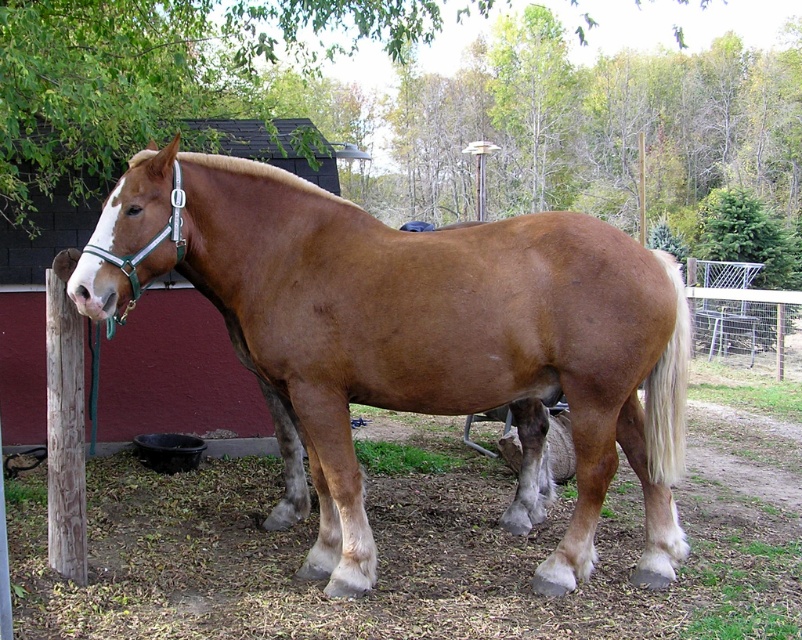
You are a farmer checking the space between the brown glossy horse at center and the white silky tail at right. You need to place a 4 feet wide feeding trough between them. Will it fit?

The distance between the brown glossy horse at center and the white silky tail at right is 3.88 feet, which is less than the 4 feet width of the feeding trough. Therefore, the trough will not fit between them.

You are a farmer checking the height of the animals in your barn. You have a 1.5 meter ladder that you need to place near the brown glossy horse at center and the white silky tail at right. Which animal requires the ladder to be placed higher?

The brown glossy horse at center requires the ladder to be placed higher because it has a greater height compared to the white silky tail at right.

You are a farmer checking the paddock. You notice the brown glossy horse at center and the white wire mesh fence at right. Which object is closer to you from your current viewpoint?

The brown glossy horse at center is closer to you than the white wire mesh fence at right because it is positioned in front of the fence.